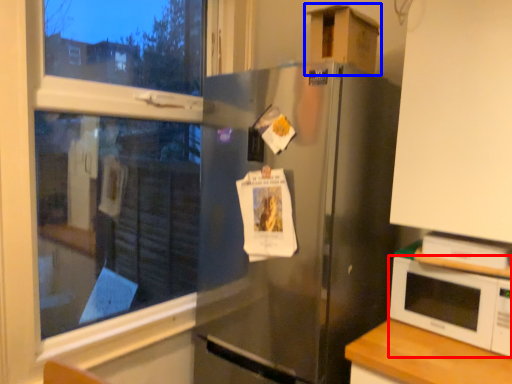
Question: Among these objects, which one is nearest to the camera, microwave oven (highlighted by a red box) or cardboard box (highlighted by a blue box)?

Choices:
 (A) microwave oven
 (B) cardboard box

Answer: (A)